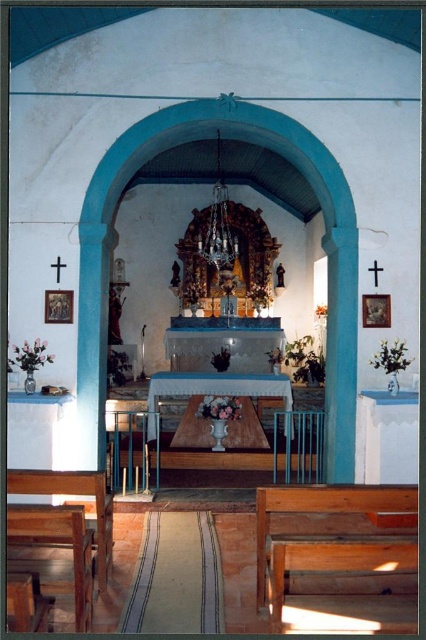
You are attending a service in the church and need to find a seat. You see two wooden benches, the wooden bench at lower right and the wooden bench at lower left. Which bench is located to the right side of the other?

The wooden bench at lower right is positioned on the right side of the wooden bench at lower left.